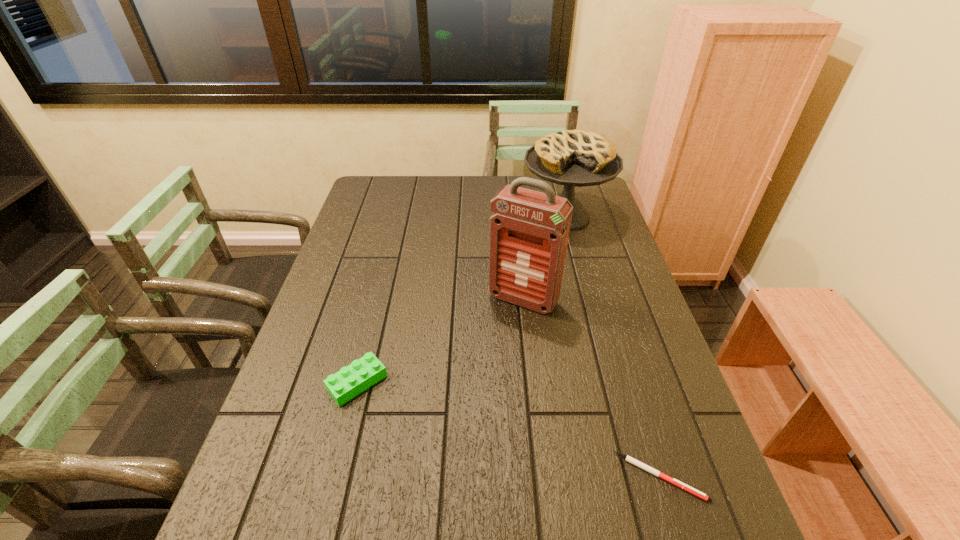
The image size is (960, 540). What are the coordinates of `free space located on the front-facing side of the first-aid kit` in the screenshot? It's located at (470, 379).

Locate an element on the screen. The width and height of the screenshot is (960, 540). free space located on the front-facing side of the first-aid kit is located at coordinates (485, 355).

You are a GUI agent. You are given a task and a screenshot of the screen. Output one action in this format:
    pyautogui.click(x=<x>, y=<y>)
    Task: Click on the vacant position located 0.160m on the cut side of the pie
    The height and width of the screenshot is (540, 960).
    Given the screenshot: What is the action you would take?
    pyautogui.click(x=538, y=269)

Locate an element on the screen. The width and height of the screenshot is (960, 540). vacant position located on the cut side of the pie is located at coordinates pyautogui.click(x=519, y=306).

Locate an element on the screen. The width and height of the screenshot is (960, 540). free region located 0.310m on the cut side of the pie is located at coordinates (522, 301).

Identify the location of object situated at the far edge. (579, 158).

The height and width of the screenshot is (540, 960). Find the location of `object positioned at the near edge`. object positioned at the near edge is located at coordinates (637, 463).

Identify the location of object positioned at the left edge. (350, 381).

Where is `pen that is at the right edge`? This screenshot has width=960, height=540. pen that is at the right edge is located at coordinates (637, 463).

Locate an element on the screen. pie that is at the right edge is located at coordinates (579, 158).